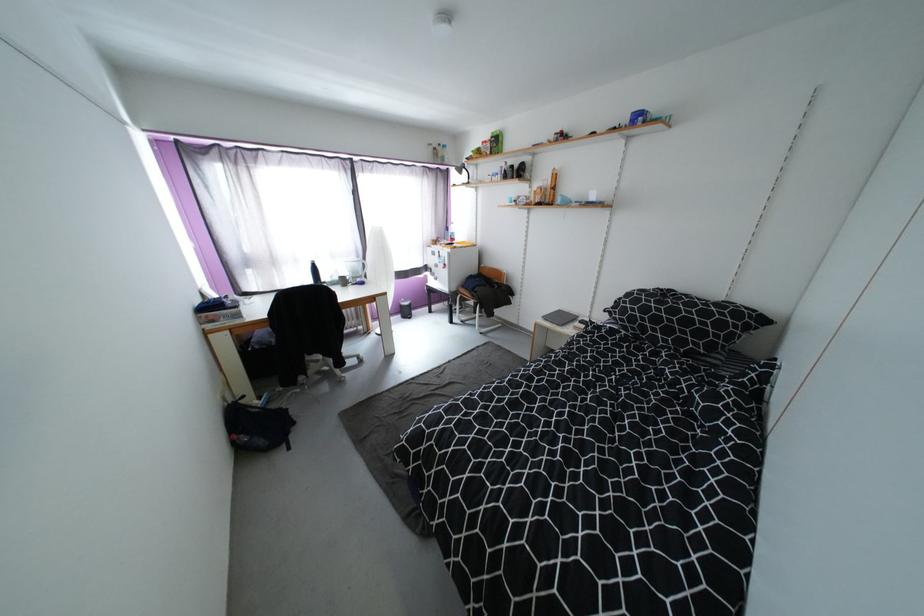
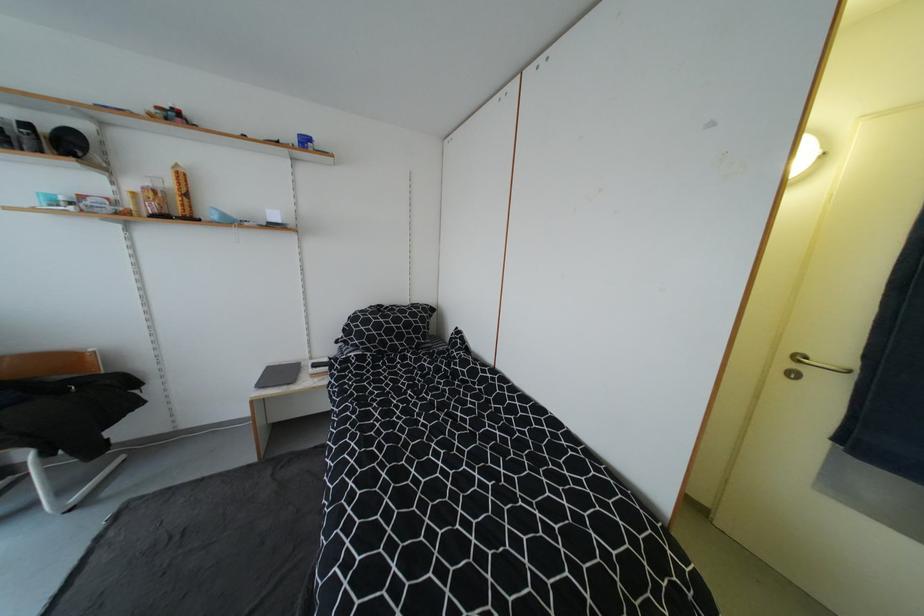
In the second image, find the point that corresponds to [566,318] in the first image.

(286, 376)